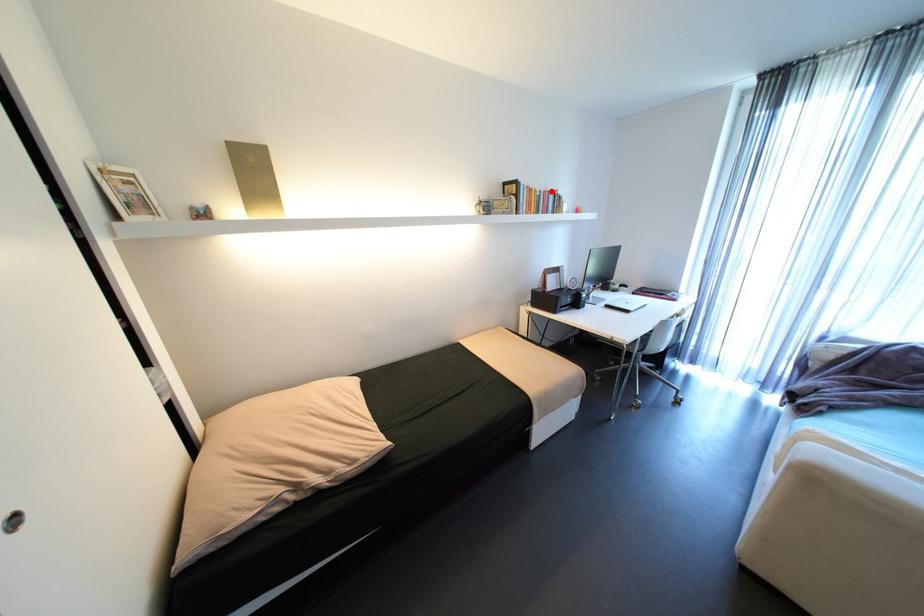
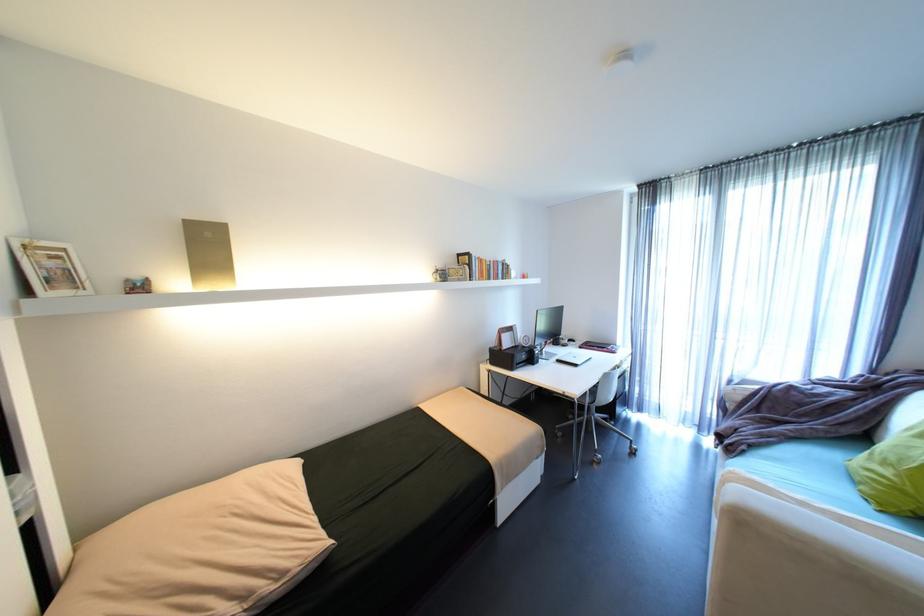
Where in the second image is the point corresponding to the highlighted location from the first image?

(500, 262)